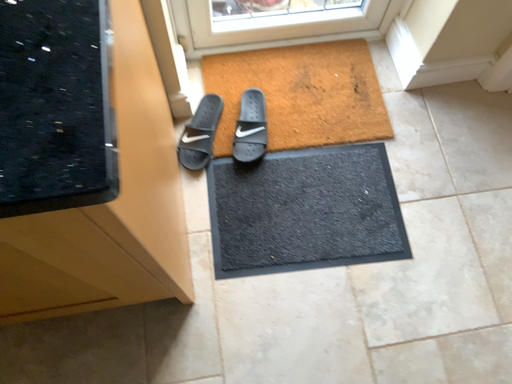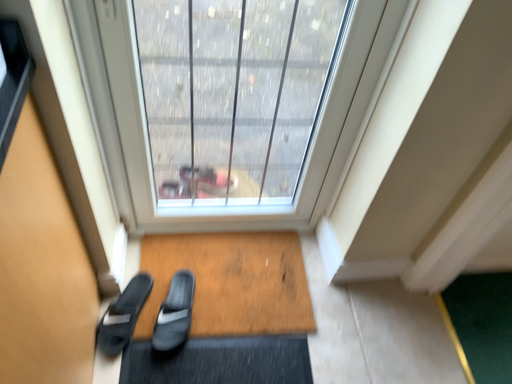
Question: How did the camera likely rotate when shooting the video?

Choices:
 (A) rotated downward
 (B) rotated upward

Answer: (B)